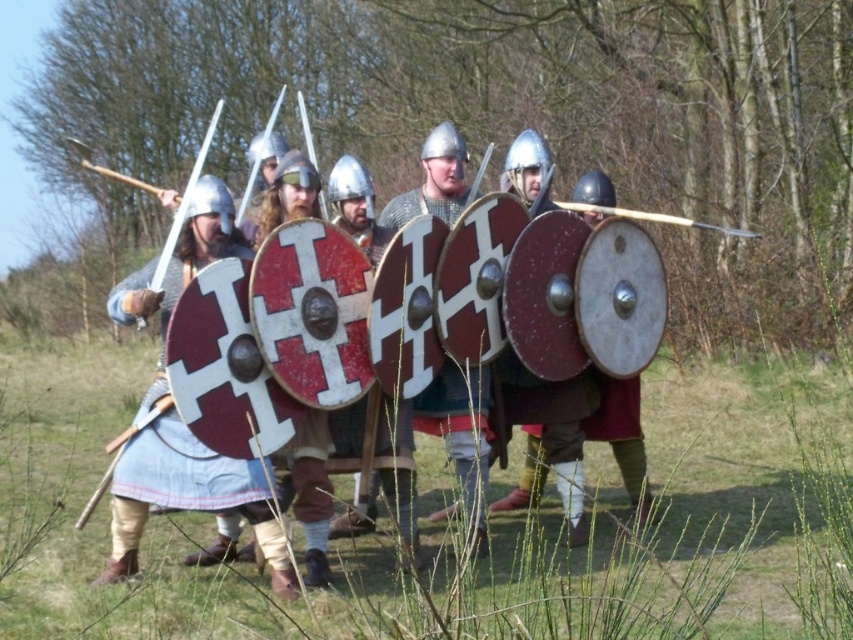
Question: Is wooden staff at lower left bigger than wooden spear at center?

Choices:
 (A) no
 (B) yes

Answer: (B)

Question: Considering the real-world distances, which object is closest to the shiny silver sword at left?

Choices:
 (A) matte silver helmet at center
 (B) wooden spear at center
 (C) wooden staff at lower left

Answer: (A)

Question: Can you confirm if shiny silver sword at left is smaller than wooden staff at lower left?

Choices:
 (A) yes
 (B) no

Answer: (B)

Question: Estimate the real-world distances between objects in this image. Which object is farther from the wooden staff at lower left?

Choices:
 (A) shiny silver sword at left
 (B) wooden spear at center

Answer: (A)

Question: Which of these objects is positioned farthest from the shiny silver sword at left?

Choices:
 (A) wooden staff at lower left
 (B) wooden spear at center

Answer: (B)

Question: Is matte silver helmet at center bigger than wooden staff at lower left?

Choices:
 (A) no
 (B) yes

Answer: (B)